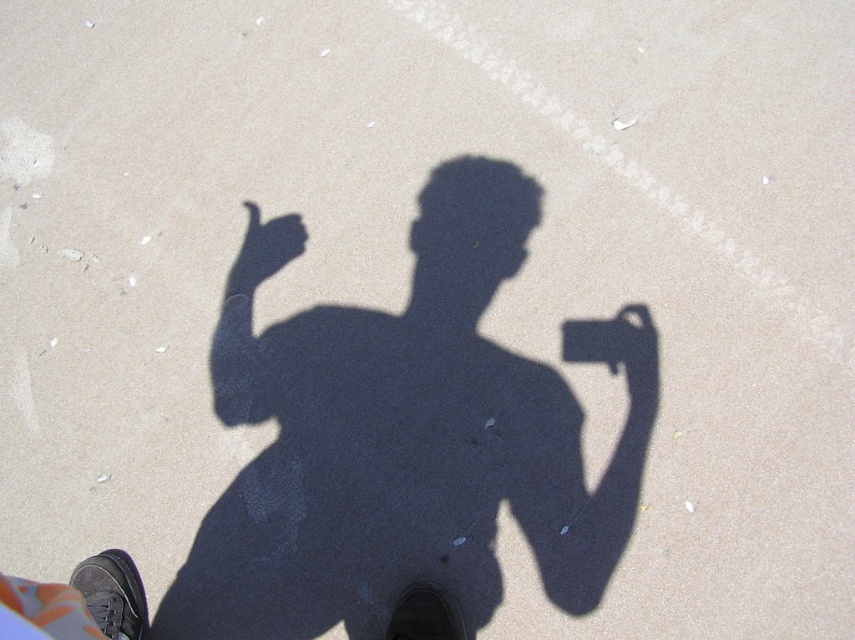
Does point (245, 253) lie behind point (634, 305)?

Yes, point (245, 253) is farther from viewer.

Can you confirm if matte black hand at center is taller than metallic silver phone at center?

In fact, matte black hand at center may be shorter than metallic silver phone at center.

Does point (246, 244) come closer to viewer compared to point (629, 326)?

No, it is behind (629, 326).

Image resolution: width=855 pixels, height=640 pixels. Find the location of `matte black hand at center`. matte black hand at center is located at coordinates [x=264, y=250].